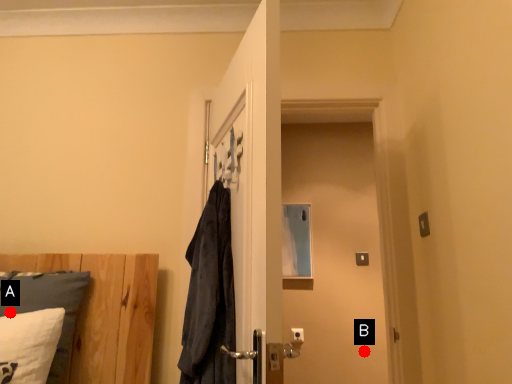
Question: Two points are circled on the image, labeled by A and B beside each circle. Which point is closer to the camera?

Choices:
 (A) A is closer
 (B) B is closer

Answer: (A)